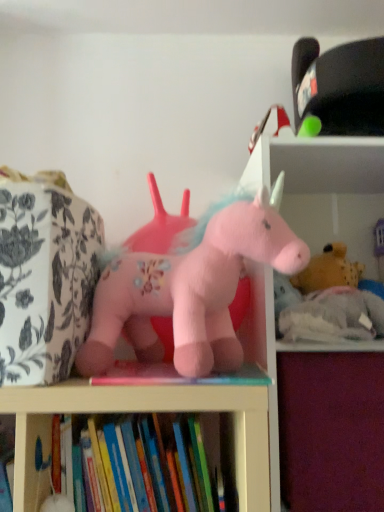
Question: From a real-world perspective, relative to fluffy pink unicorn at center, which is the 1th toy from front to back, is hardcover book at lower center vertically above or below?

Choices:
 (A) below
 (B) above

Answer: (A)

Question: Choose the correct answer: Is hardcover book at lower center inside fluffy pink unicorn at center, which is the 2th toy from back to front, or outside it?

Choices:
 (A) outside
 (B) inside

Answer: (A)

Question: Which object is the closest to the hardcover book at lower center?

Choices:
 (A) purple fabric drawer at lower right
 (B) soft white bookshelf at upper right
 (C) fluffy pink unicorn at center, which is the 1th toy from front to back
 (D) fluffy pink unicorn at center, positioned as the first toy in right-to-left order

Answer: (C)

Question: Which object is the farthest from the fluffy pink unicorn at center, which is the 2th toy from back to front?

Choices:
 (A) purple fabric drawer at lower right
 (B) hardcover book at lower center
 (C) soft white bookshelf at upper right
 (D) fluffy pink unicorn at center, which is the first toy in back-to-front order

Answer: (A)